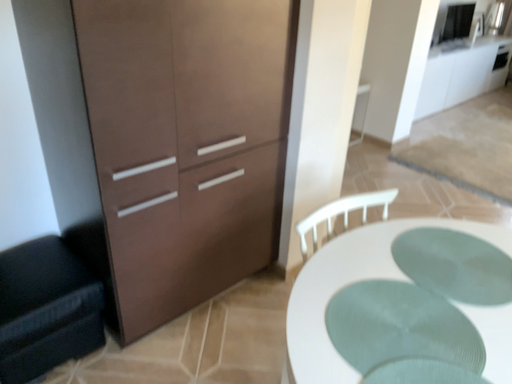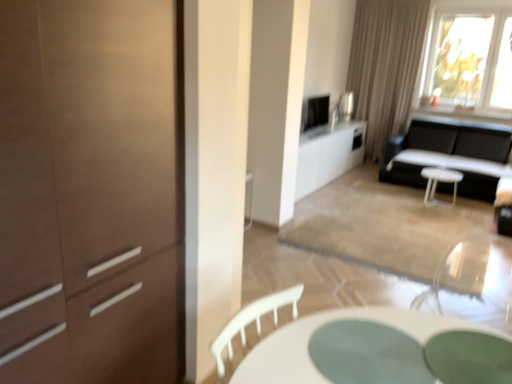
Question: How did the camera likely rotate when shooting the video?

Choices:
 (A) rotated right
 (B) rotated left

Answer: (A)